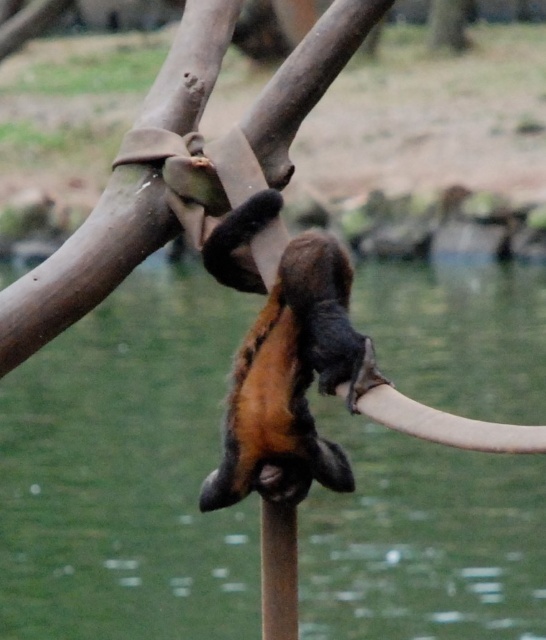
Looking at the image of the flying fox hanging from the branch, can you determine which object is larger between the brown furry monkey at center and the smooth bark tree at upper center?

The brown furry monkey at center is smaller than the smooth bark tree at upper center, so the smooth bark tree at upper center is larger.

You are a zookeeper observing the flying fox exhibit. You notice the brown furry monkey at center and the smooth bark tree at upper center. Which object is positioned higher in the image?

The smooth bark tree at upper center is positioned higher in the image than the brown furry monkey at center.